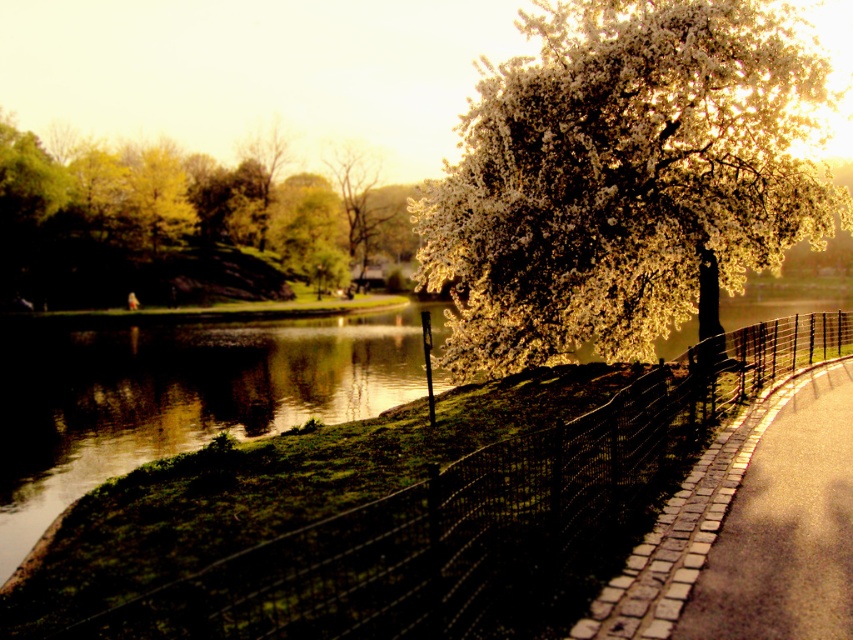
How much distance is there between green leafy tree at left and brick paved path at center right?

green leafy tree at left is 44.44 meters from brick paved path at center right.

Between point (248, 294) and point (730, 433), which one is positioned behind?

Positioned behind is point (248, 294).

Find the location of a particular element. The height and width of the screenshot is (640, 853). green leafy tree at left is located at coordinates (157, 227).

Does point (519, 291) come closer to viewer compared to point (351, 177)?

Yes.

Between white blossoming tree at upper right and smooth white blossoms at upper center, which one appears on the right side from the viewer's perspective?

Positioned to the right is white blossoming tree at upper right.

Does point (752, 221) come closer to viewer compared to point (357, 180)?

That is True.

Find the location of a particular element. The width and height of the screenshot is (853, 640). white blossoming tree at upper right is located at coordinates (625, 179).

Which of these two, white blossoming tree at upper right or green leafy tree at left, stands taller?

Standing taller between the two is green leafy tree at left.

Measure the distance between white blossoming tree at upper right and green leafy tree at left.

The distance of white blossoming tree at upper right from green leafy tree at left is 32.44 meters.

Is point (764, 102) farther from camera compared to point (291, 214)?

No.

Locate an element on the screen. white blossoming tree at upper right is located at coordinates pyautogui.click(x=625, y=179).